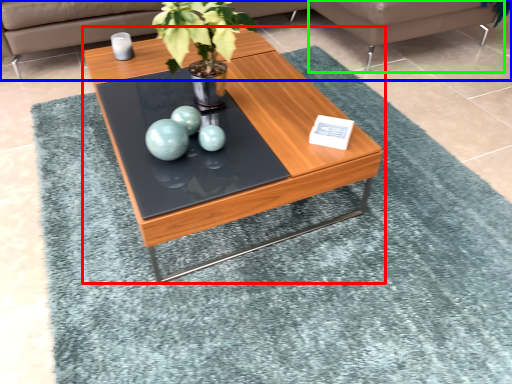
Question: Which object is positioned closest to coffee table (highlighted by a red box)? Select from studio couch (highlighted by a blue box) and couch (highlighted by a green box).

Choices:
 (A) studio couch
 (B) couch

Answer: (B)